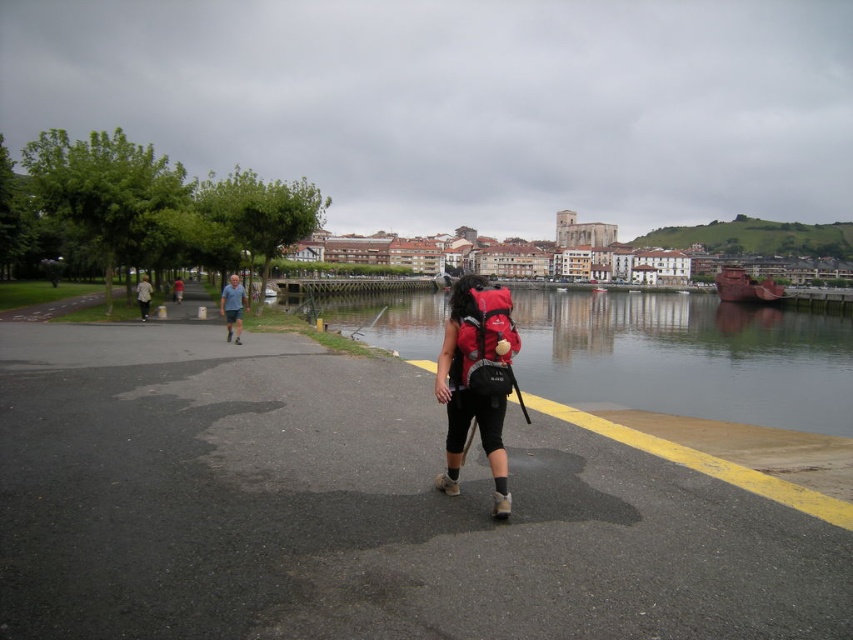
You are a photographer standing at the riverside and want to capture both the red matte backpack at center and the gray fabric shorts at left in the same frame. Given that your camera has a maximum horizontal field of view of 100 feet, will you be able to fit both objects into the shot?

The red matte backpack at center and the gray fabric shorts at left are 124.88 feet apart from each other. Since the camera can only capture up to 100 feet horizontally, the distance between them exceeds the camera capabilities. Therefore, you won not be able to fit both objects into the same frame.

You are a hiker who wants to check the distance between your backpack and your shorts. You see the matte red backpack at center and the gray fabric shorts at left. Which item is closer to you?

The matte red backpack at center is shorter than gray fabric shorts at left, so the gray fabric shorts at left are closer to you.

You are a hiker who wants to carry both the red matte backpack at center and the light gray fabric pants at center. Which item can hold more items based on their sizes?

The light gray fabric pants at center can hold more items because it has a larger size compared to the red matte backpack at center.